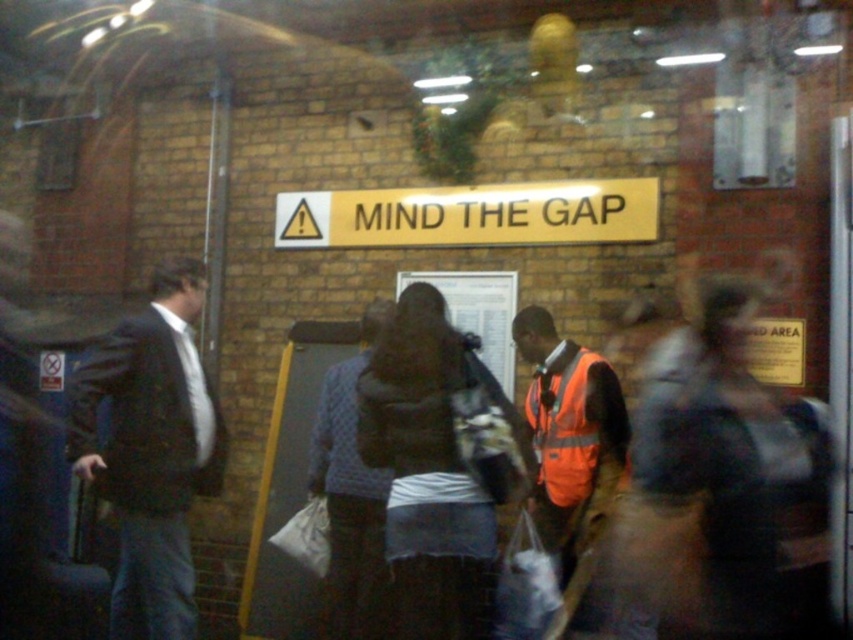
Question: Is gold metallic sign at center bigger than orange reflective safety vest at center?

Choices:
 (A) yes
 (B) no

Answer: (A)

Question: In this image, where is orange reflective vest at left located relative to gold metallic sign at center?

Choices:
 (A) above
 (B) below

Answer: (B)

Question: Can you confirm if gold metallic sign at center is positioned to the left of orange reflective safety vest at center?

Choices:
 (A) yes
 (B) no

Answer: (A)

Question: Which point is farther from the camera taking this photo?

Choices:
 (A) pyautogui.click(x=86, y=442)
 (B) pyautogui.click(x=619, y=198)
 (C) pyautogui.click(x=589, y=420)

Answer: (B)

Question: Which of the following is the farthest from the observer?

Choices:
 (A) gold metallic sign at center
 (B) orange reflective safety vest at center
 (C) orange reflective vest at left

Answer: (A)

Question: Which object is closer to the camera taking this photo?

Choices:
 (A) orange reflective vest at left
 (B) orange reflective safety vest at center
 (C) gold metallic sign at center

Answer: (A)